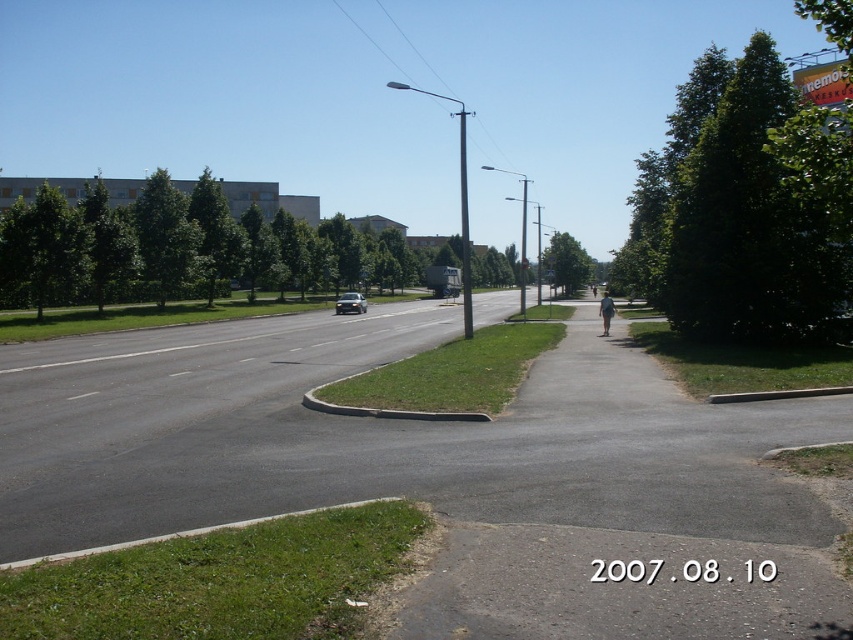
Can you confirm if green leafy tree at right is bigger than green leafy tree at left?

Yes, green leafy tree at right is bigger than green leafy tree at left.

Is green leafy tree at right below green leafy tree at left?

No, green leafy tree at right is not below green leafy tree at left.

Who is more forward, (827, 166) or (148, 227)?

Positioned in front is point (827, 166).

Locate an element on the screen. This screenshot has height=640, width=853. green leafy tree at right is located at coordinates (746, 208).

Can you confirm if silver metallic car at center is taller than white plastic street sign at center?

In fact, silver metallic car at center may be shorter than white plastic street sign at center.

Does silver metallic car at center appear over white plastic street sign at center?

Incorrect, silver metallic car at center is not positioned above white plastic street sign at center.

The image size is (853, 640). I want to click on silver metallic car at center, so click(x=350, y=304).

Can you confirm if green leafy tree at left is smaller than green leafy tree at center?

No.

In the scene shown: Between green leafy tree at left and green leafy tree at center, which one is positioned lower?

green leafy tree at center is lower down.

Which is in front, point (177, 241) or point (560, 232)?

Positioned in front is point (177, 241).

Where is `green leafy tree at left`? Image resolution: width=853 pixels, height=640 pixels. green leafy tree at left is located at coordinates (165, 234).